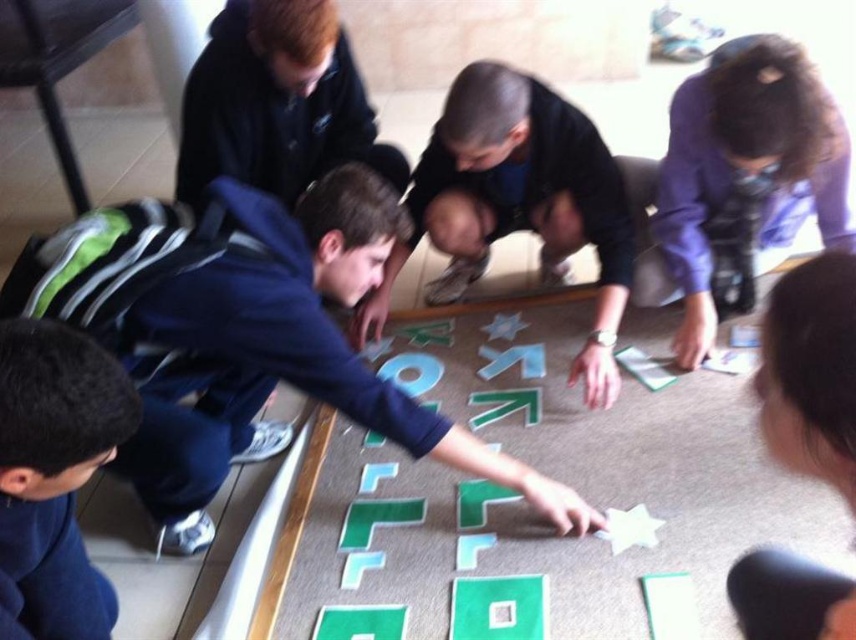
Question: Does dark blue shirt at center have a larger size compared to purple fabric at upper right?

Choices:
 (A) yes
 (B) no

Answer: (A)

Question: Which of the following is the closest to the observer?

Choices:
 (A) black matte hair at lower left
 (B) dark blue shirt at center

Answer: (A)

Question: Does dark blue shirt at center have a greater width compared to dark brown hair at lower right?

Choices:
 (A) yes
 (B) no

Answer: (A)

Question: Which point appears closest to the camera in this image?

Choices:
 (A) (283, 260)
 (B) (16, 545)
 (C) (789, 240)
 (D) (397, 259)

Answer: (B)

Question: Which object is the closest to the black matte hair at lower left?

Choices:
 (A) dark blue shirt at center
 (B) dark brown hair at lower right
 (C) blue fabric shirt at center
 (D) purple fabric at upper right

Answer: (C)

Question: Does dark blue shirt at center have a greater width compared to black matte hair at lower left?

Choices:
 (A) yes
 (B) no

Answer: (A)